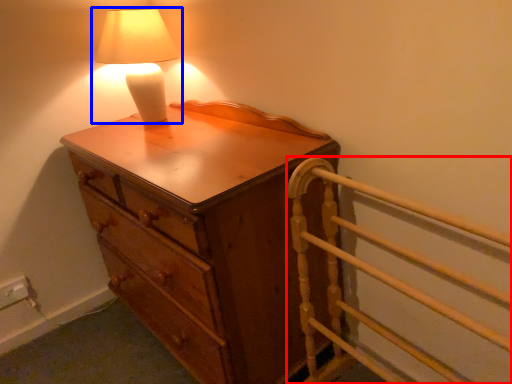
Question: Among these objects, which one is farthest to the camera, bed frame (highlighted by a red box) or lamp (highlighted by a blue box)?

Choices:
 (A) bed frame
 (B) lamp

Answer: (B)